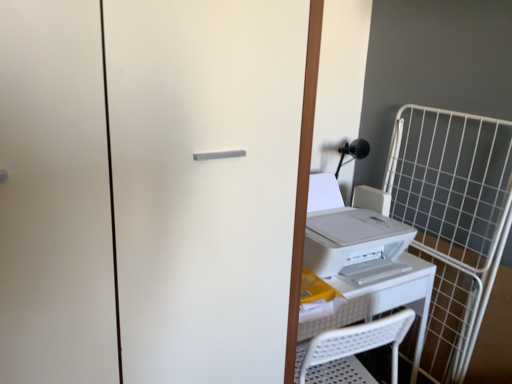
Describe the element at coordinates (382, 302) in the screenshot. Image resolution: width=512 pixels, height=384 pixels. I see `white plastic table at center` at that location.

I want to click on white plastic printer at right, so click(350, 237).

The width and height of the screenshot is (512, 384). Describe the element at coordinates (350, 237) in the screenshot. I see `white plastic printer at right` at that location.

Measure the distance between white matte screen door at center and camera.

A distance of 27.33 inches exists between white matte screen door at center and camera.

Image resolution: width=512 pixels, height=384 pixels. In order to click on white plastic table at center in this screenshot , I will do `click(382, 302)`.

Is white plastic table at center to the left or to the right of white plastic printer at right in the image?

In the image, white plastic table at center appears on the left side of white plastic printer at right.

Which of these two, white plastic table at center or white plastic printer at right, is wider?

white plastic table at center.

Considering the positions of point (387, 296) and point (361, 227), is point (387, 296) closer or farther from the camera than point (361, 227)?

Point (387, 296).

Does white plastic table at center turn towards white plastic printer at right?

No, white plastic table at center is not oriented towards white plastic printer at right.

Considering the relative positions of white plastic table at center and white wire cage at right in the image provided, is white plastic table at center to the right of white wire cage at right from the viewer's perspective?

Incorrect, white plastic table at center is not on the right side of white wire cage at right.

Is white plastic table at center facing away from white wire cage at right?

No, white wire cage at right is not at the back of white plastic table at center.

From a real-world perspective, does white plastic table at center sit lower than white wire cage at right?

No, from a real-world perspective, white plastic table at center is not beneath white wire cage at right.

Between white plastic table at center and white wire cage at right, which one has smaller size?

With smaller size is white wire cage at right.

Looking at this image, which of these two, white plastic printer at right or white matte screen door at center, is thinner?

white plastic printer at right.

From the image's perspective, is white plastic printer at right located above or below white matte screen door at center?

white plastic printer at right is situated higher than white matte screen door at center in the image.

From the picture: Could you tell me if white plastic printer at right is turned towards white matte screen door at center?

No, white plastic printer at right is not facing towards white matte screen door at center.

Is white plastic printer at right beside white wire cage at right?

No.

From a real-world perspective, is white plastic printer at right on white wire cage at right?

Indeed, from a real-world perspective, white plastic printer at right stands above white wire cage at right.

Is white plastic printer at right oriented away from white wire cage at right?

No, white wire cage at right is not at the back of white plastic printer at right.

At what (x,y) coordinates should I click in order to perform the action: click on cage on the right of white plastic printer at right. Please return your answer as a coordinate pair (x, y). Looking at the image, I should click on (452, 220).

From a real-world perspective, does white wire cage at right sit lower than white plastic table at center?

Correct, in the physical world, white wire cage at right is lower than white plastic table at center.

Considering the positions of objects white wire cage at right and white plastic table at center in the image provided, who is more to the left, white wire cage at right or white plastic table at center?

white plastic table at center is more to the left.

Where is `cage behind the white plastic table at center`? cage behind the white plastic table at center is located at coordinates (452, 220).

Considering the sizes of white wire cage at right and white plastic table at center in the image, is white wire cage at right bigger or smaller than white plastic table at center?

In the image, white wire cage at right appears to be smaller than white plastic table at center.

Where is `cage located behind the white matte screen door at center`? Image resolution: width=512 pixels, height=384 pixels. cage located behind the white matte screen door at center is located at coordinates (x=452, y=220).

Would you say white matte screen door at center is part of white wire cage at right's contents?

No, white matte screen door at center is not a part of white wire cage at right.

Is white wire cage at right bigger than white matte screen door at center?

Incorrect, white wire cage at right is not larger than white matte screen door at center.

Considering the sizes of objects white plastic printer at right and white plastic table at center in the image provided, who is bigger, white plastic printer at right or white plastic table at center?

white plastic table at center is bigger.

Is the depth of white plastic printer at right less than that of white plastic table at center?

No, white plastic printer at right is further to the viewer.

From their relative heights in the image, would you say white plastic printer at right is taller or shorter than white plastic table at center?

white plastic printer at right is shorter than white plastic table at center.

Find the location of a particular element. The image size is (512, 384). table below the white plastic printer at right (from a real-world perspective) is located at coordinates (382, 302).

There is a white wire cage at right. Find the location of `table above it (from a real-world perspective)`. table above it (from a real-world perspective) is located at coordinates (382, 302).

When comparing their distances from white matte screen door at center, does white wire cage at right or white plastic table at center seem closer?

white plastic table at center lies closer to white matte screen door at center than the other object.

Estimate the real-world distances between objects in this image. Which object is closer to white matte screen door at center, white wire cage at right or white plastic printer at right?

white plastic printer at right is positioned closer to the anchor white matte screen door at center.

When comparing their distances from white plastic table at center, does white matte screen door at center or white wire cage at right seem closer?

Based on the image, white wire cage at right appears to be nearer to white plastic table at center.

Based on their spatial positions, is white plastic table at center or white wire cage at right further from white matte screen door at center?

white wire cage at right is further to white matte screen door at center.

From the image, which object appears to be farther from white wire cage at right, white plastic table at center or white matte screen door at center?

Among the two, white matte screen door at center is located further to white wire cage at right.

Estimate the real-world distances between objects in this image. Which object is closer to white plastic table at center, white wire cage at right or white plastic printer at right?

white plastic printer at right is positioned closer to the anchor white plastic table at center.

Estimate the real-world distances between objects in this image. Which object is closer to white matte screen door at center, white plastic table at center or white plastic printer at right?

white plastic printer at right is positioned closer to the anchor white matte screen door at center.

Which object lies nearer to the anchor point white plastic table at center, white plastic printer at right or white wire cage at right?

Based on the image, white plastic printer at right appears to be nearer to white plastic table at center.

Where is `table between white matte screen door at center and white plastic printer at right in the front-back direction`? The height and width of the screenshot is (384, 512). table between white matte screen door at center and white plastic printer at right in the front-back direction is located at coordinates (382, 302).

Locate an element on the screen. cage that lies between white plastic printer at right and white plastic table at center from top to bottom is located at coordinates (452, 220).

Image resolution: width=512 pixels, height=384 pixels. Find the location of `home appliance between white matte screen door at center and white wire cage at right from left to right`. home appliance between white matte screen door at center and white wire cage at right from left to right is located at coordinates (350, 237).

What are the coordinates of `table located between white matte screen door at center and white wire cage at right in the left-right direction` in the screenshot? It's located at (382, 302).